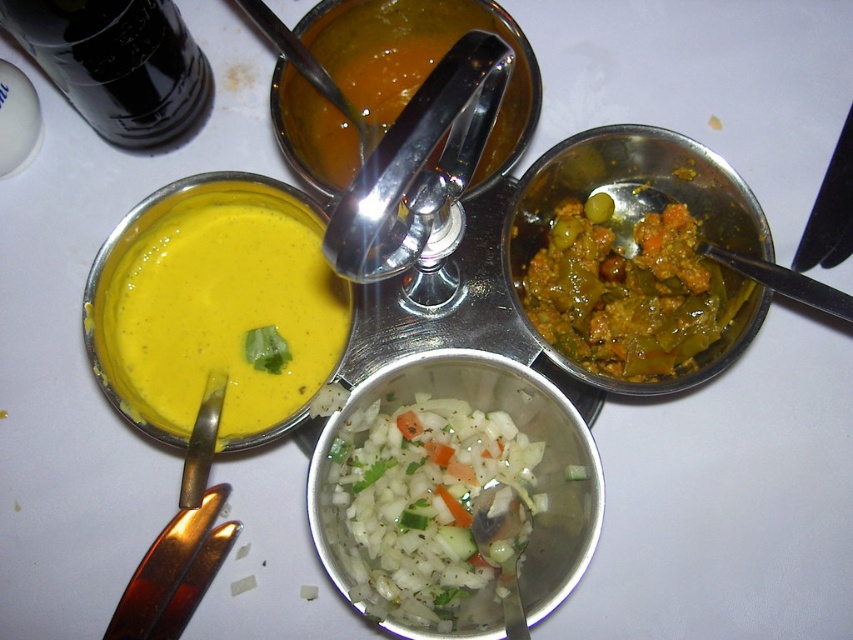
Can you confirm if white translucent chopped vegetables at center is thinner than green matte vegetable at center?

In fact, white translucent chopped vegetables at center might be wider than green matte vegetable at center.

This screenshot has width=853, height=640. Identify the location of white translucent chopped vegetables at center. (434, 508).

Identify the location of white translucent chopped vegetables at center. (434, 508).

Who is lower down, green leafy vegetable at center or green matte vegetable at center?

green leafy vegetable at center is lower down.

Is green leafy vegetable at center to the left of green matte vegetable at center from the viewer's perspective?

Indeed, green leafy vegetable at center is positioned on the left side of green matte vegetable at center.

Between point (245, 346) and point (590, 198), which one is positioned in front?

Point (245, 346) is more forward.

Identify the location of green leafy vegetable at center. tap(265, 349).

From the picture: Does green matte curry at upper right lie behind green cucumber at center?

Yes, it is.

Is point (543, 282) positioned before point (572, 472)?

No, it is not.

In order to click on green matte curry at upper right in this screenshot , I will do `click(630, 292)`.